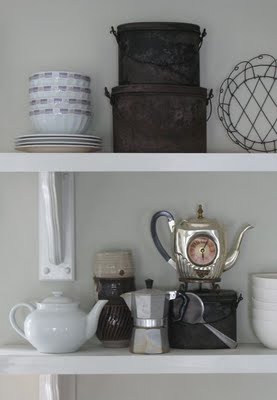
At what (x,y) coordinates should I click in order to perform the action: click on teapot. Please return your answer as a coordinate pair (x, y). The width and height of the screenshot is (277, 400). Looking at the image, I should click on (147, 312), (60, 328), (185, 236).